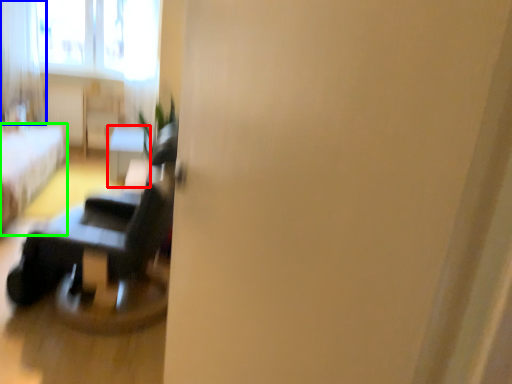
Question: Which object is the closest to the table (highlighted by a red box)? Choose among these: curtain (highlighted by a blue box) or furniture (highlighted by a green box).

Choices:
 (A) curtain
 (B) furniture

Answer: (B)